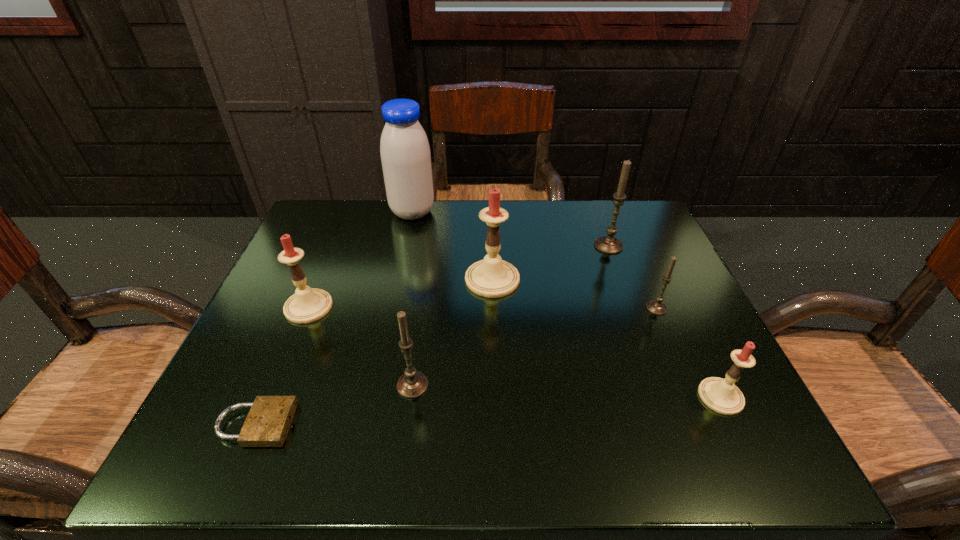
Identify which object is located as the fifth nearest to the farthest gray candle. Please provide its 2D coordinates. Your answer should be formatted as a tuple, i.e. [(x, y)], where the tuple contains the x and y coordinates of a point satisfying the conditions above.

[(412, 384)]

Identify which candle is the fourth closest to the second smallest red candle. Please provide its 2D coordinates. Your answer should be formatted as a tuple, i.e. [(x, y)], where the tuple contains the x and y coordinates of a point satisfying the conditions above.

[(656, 306)]

Identify which candle is the fifth closest to the farthest candle. Please provide its 2D coordinates. Your answer should be formatted as a tuple, i.e. [(x, y)], where the tuple contains the x and y coordinates of a point satisfying the conditions above.

[(307, 305)]

Select which gray candle is the second closest to the second biggest gray candle. Please provide its 2D coordinates. Your answer should be formatted as a tuple, i.e. [(x, y)], where the tuple contains the x and y coordinates of a point satisfying the conditions above.

[(608, 244)]

Find the location of a particular element. the second closest gray candle to the nearest gray candle is located at coordinates (608, 244).

Locate an element on the screen. The width and height of the screenshot is (960, 540). red candle that is the second closest one to the shortest object is located at coordinates (492, 277).

You are a GUI agent. You are given a task and a screenshot of the screen. Output one action in this format:
    pyautogui.click(x=<x>, y=<y>)
    Task: Click on the red candle that is the closest to the farthest candle
    
    Given the screenshot: What is the action you would take?
    pyautogui.click(x=492, y=277)

Where is `free spot that satisfies the following two spatial constraints: 1. on the front side of the nearest red candle; 2. on the right side of the leftmost candle`? The image size is (960, 540). free spot that satisfies the following two spatial constraints: 1. on the front side of the nearest red candle; 2. on the right side of the leftmost candle is located at coordinates (272, 396).

Locate an element on the screen. Image resolution: width=960 pixels, height=540 pixels. free region that satisfies the following two spatial constraints: 1. on the front side of the fourth object from right to left; 2. on the keyhole side of the shortest object is located at coordinates click(497, 424).

Where is `free spot that satisfies the following two spatial constraints: 1. on the front side of the tallest object; 2. on the right side of the farthest candle`? free spot that satisfies the following two spatial constraints: 1. on the front side of the tallest object; 2. on the right side of the farthest candle is located at coordinates (405, 246).